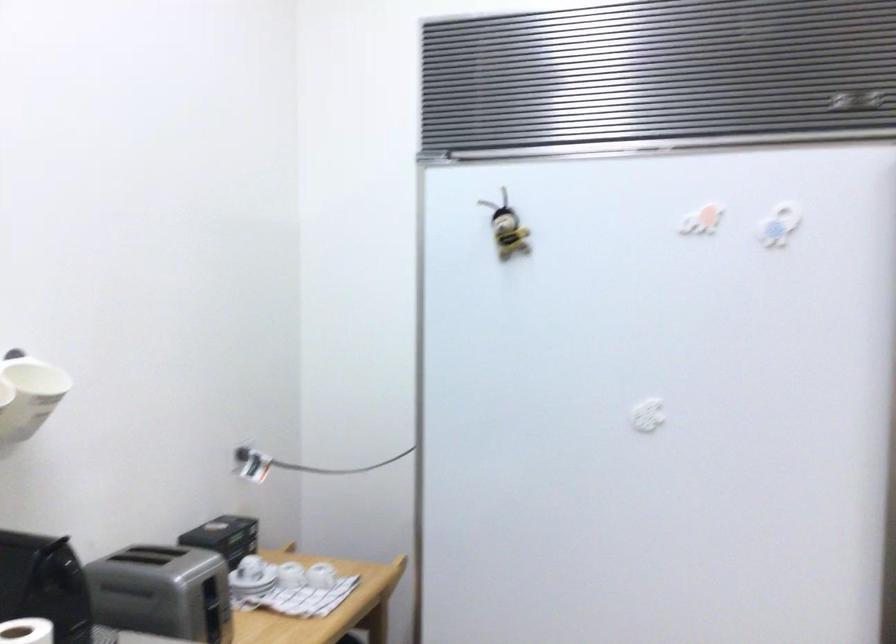
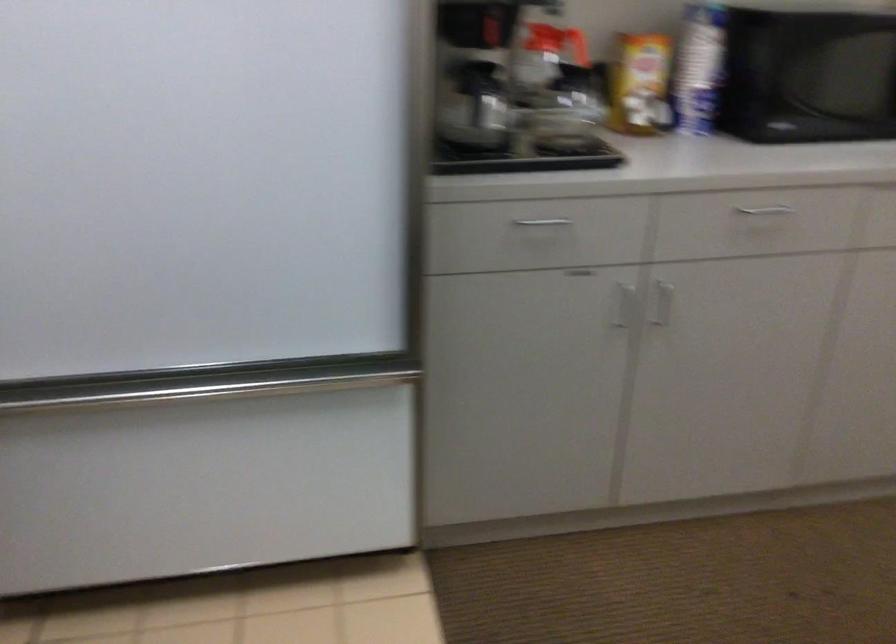
The first image is from the beginning of the video and the second image is from the end. How did the camera likely rotate when shooting the video?

The rotation direction of the camera is right-down.